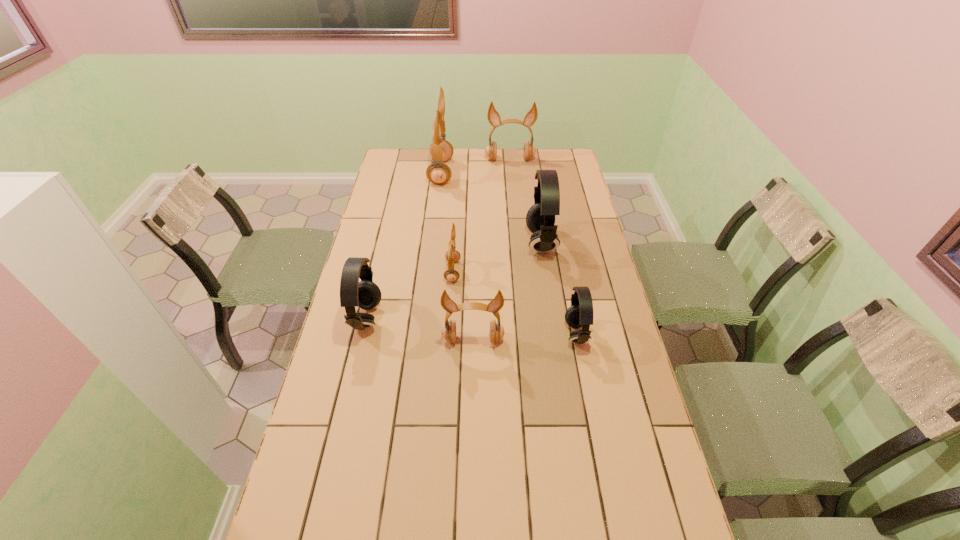
At what (x,y) coordinates should I click in order to perform the action: click on vacant area between the smallest brown earphone and the third smallest brown earphone. Please return your answer as a coordinate pair (x, y). The height and width of the screenshot is (540, 960). Looking at the image, I should click on (481, 215).

You are a GUI agent. You are given a task and a screenshot of the screen. Output one action in this format:
    pyautogui.click(x=<x>, y=<y>)
    Task: Click on the free point between the third smallest brown earphone and the second smallest brown earphone
    This screenshot has height=540, width=960.
    Given the screenshot: What is the action you would take?
    pyautogui.click(x=492, y=249)

You are a GUI agent. You are given a task and a screenshot of the screen. Output one action in this format:
    pyautogui.click(x=<x>, y=<y>)
    Task: Click on the empty space between the third smallest brown earphone and the tallest object
    The image size is (960, 540).
    Given the screenshot: What is the action you would take?
    pyautogui.click(x=475, y=166)

Locate which object ranks fourth in proximity to the third biggest brown earphone. Please provide its 2D coordinates. Your answer should be formatted as a tuple, i.e. [(x, y)], where the tuple contains the x and y coordinates of a point satisfying the conditions above.

[(540, 219)]

What are the coordinates of `object that is the nearest to the second biggest brown earphone` in the screenshot? It's located at (441, 150).

You are a GUI agent. You are given a task and a screenshot of the screen. Output one action in this format:
    pyautogui.click(x=<x>, y=<y>)
    Task: Click on the closest earphone to the biggest black earphone
    The width and height of the screenshot is (960, 540).
    Given the screenshot: What is the action you would take?
    pyautogui.click(x=580, y=314)

The width and height of the screenshot is (960, 540). What are the coordinates of `the third closest earphone to the third biggest brown earphone` in the screenshot? It's located at (365, 294).

Choose which brown earphone is the second nearest neighbor to the tallest object. Please provide its 2D coordinates. Your answer should be formatted as a tuple, i.e. [(x, y)], where the tuple contains the x and y coordinates of a point satisfying the conditions above.

[(452, 256)]

Image resolution: width=960 pixels, height=540 pixels. What are the coordinates of `brown earphone that is the third closest to the tallest object` in the screenshot? It's located at (448, 332).

Select which black earphone appears as the closest to the third biggest brown earphone. Please provide its 2D coordinates. Your answer should be formatted as a tuple, i.e. [(x, y)], where the tuple contains the x and y coordinates of a point satisfying the conditions above.

[(580, 314)]